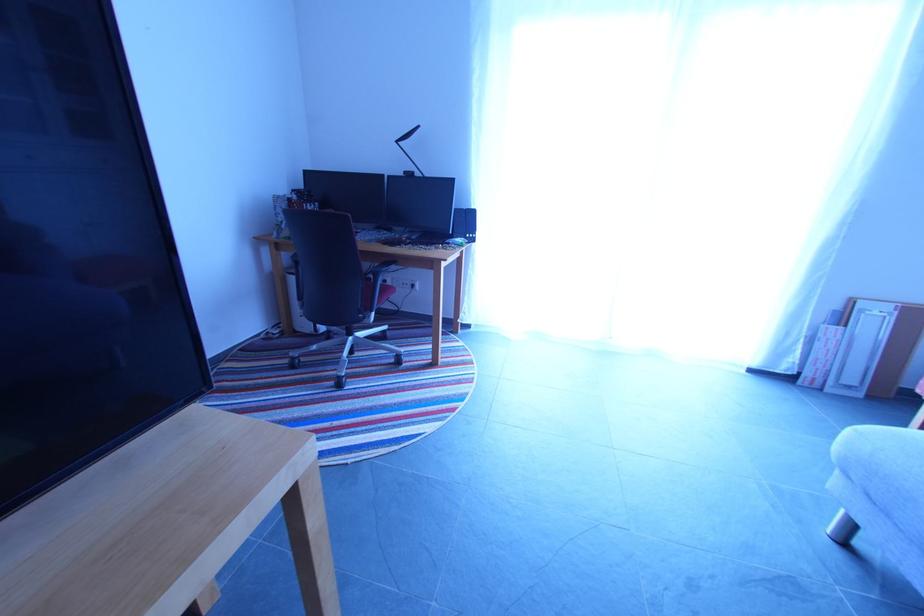
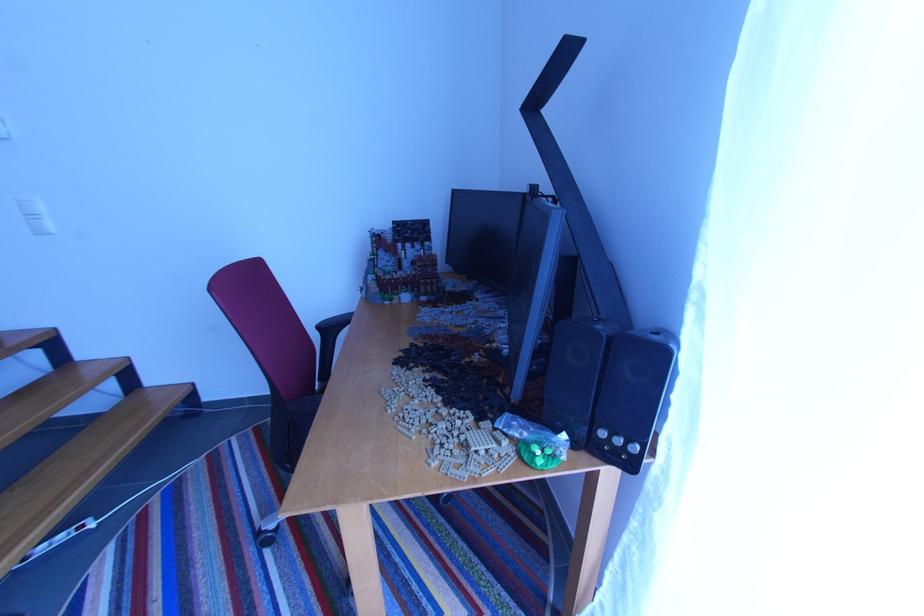
In the second image, find the point that corresponds to [476,237] in the first image.

(623, 443)